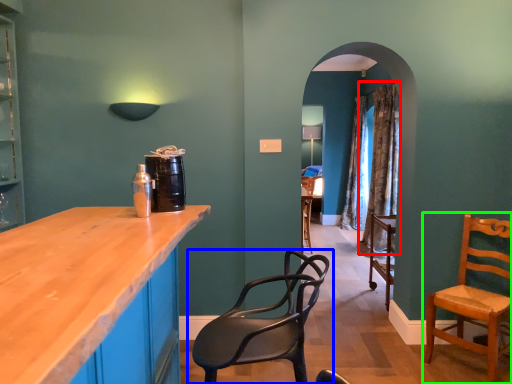
Question: Which object is positioned farthest from curtain (highlighted by a red box)? Select from chair (highlighted by a blue box) and chair (highlighted by a green box).

Choices:
 (A) chair
 (B) chair

Answer: (A)